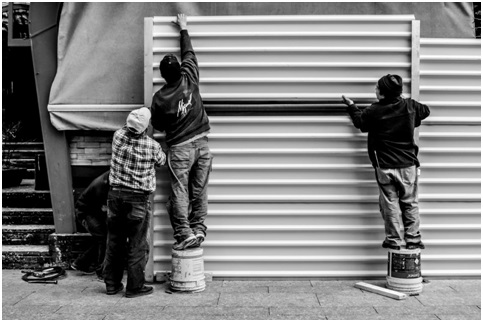
Find the location of a particular element. bucket is located at coordinates (405, 260).